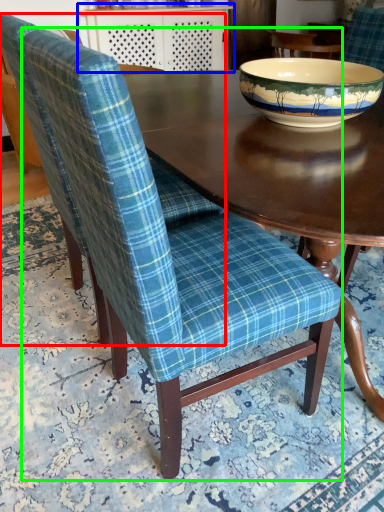
Question: Based on their relative distances, which object is nearer to chair (highlighted by a red box)? Choose from table (highlighted by a blue box) and chair (highlighted by a green box).

Choices:
 (A) table
 (B) chair

Answer: (B)